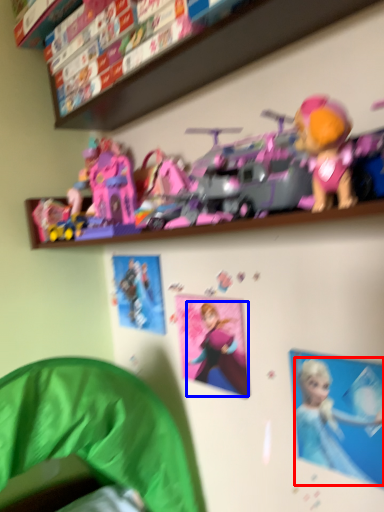
Question: Which of the following is the closest to the observer, person (highlighted by a red box) or toy (highlighted by a blue box)?

Choices:
 (A) person
 (B) toy

Answer: (A)